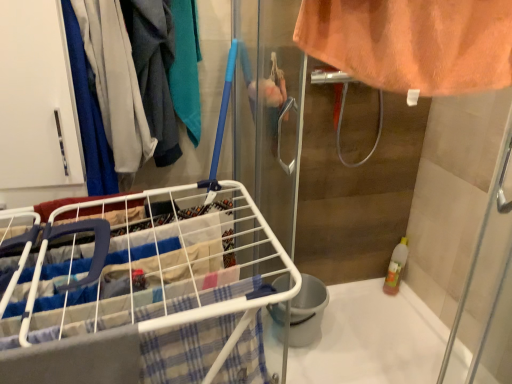
This screenshot has width=512, height=384. What do you see at coordinates (145, 74) in the screenshot? I see `matte blue fabric at left` at bounding box center [145, 74].

Find the location of a particular element. The width and height of the screenshot is (512, 384). white glossy bath at lower right is located at coordinates (372, 339).

From a real-world perspective, is white glossy bath at lower right above or below matte blue fabric at left?

white glossy bath at lower right is situated lower than matte blue fabric at left in the real world.

Could you tell me if white glossy bath at lower right is turned towards matte blue fabric at left?

No.

How much distance is there between white glossy bath at lower right and matte blue fabric at left?

white glossy bath at lower right and matte blue fabric at left are 3.67 feet apart.

Considering the sizes of objects white glossy bath at lower right and matte blue fabric at left in the image provided, who is smaller, white glossy bath at lower right or matte blue fabric at left?

Smaller between the two is matte blue fabric at left.

Is point (3, 329) closer or farther from the camera than point (177, 102)?

Point (3, 329) is closer to the camera than point (177, 102).

Consider the image. Is white wire laundry cart at lower left not inside matte blue fabric at left?

Absolutely, white wire laundry cart at lower left is external to matte blue fabric at left.

Which of these two, white wire laundry cart at lower left or matte blue fabric at left, is smaller?

With smaller size is matte blue fabric at left.

Which object is closer to the camera taking this photo, white wire laundry cart at lower left or white glossy bath at lower right?

Positioned in front is white wire laundry cart at lower left.

Is point (30, 290) positioned after point (408, 293)?

No.

From the image's perspective, is white wire laundry cart at lower left below white glossy bath at lower right?

Incorrect, from the image's perspective, white wire laundry cart at lower left is higher than white glossy bath at lower right.

From a real-world perspective, is white glossy bath at lower right under white wire laundry cart at lower left?

Yes, from a real-world perspective, white glossy bath at lower right is under white wire laundry cart at lower left.

Is white glossy bath at lower right taller than white wire laundry cart at lower left?

No.

Based on the photo, between white glossy bath at lower right and white wire laundry cart at lower left, which one appears on the left side from the viewer's perspective?

Positioned to the left is white wire laundry cart at lower left.

Is matte blue fabric at left located outside white wire laundry cart at lower left?

That's correct, matte blue fabric at left is outside of white wire laundry cart at lower left.

From a real-world perspective, between matte blue fabric at left and white wire laundry cart at lower left, who is vertically higher?

matte blue fabric at left, from a real-world perspective.

Considering the sizes of objects matte blue fabric at left and white wire laundry cart at lower left in the image provided, who is wider, matte blue fabric at left or white wire laundry cart at lower left?

Wider between the two is white wire laundry cart at lower left.

Considering the positions of objects matte blue fabric at left and white wire laundry cart at lower left in the image provided, who is in front, matte blue fabric at left or white wire laundry cart at lower left?

white wire laundry cart at lower left is in front.

From the image's perspective, is matte blue fabric at left over white glossy bath at lower right?

Correct, matte blue fabric at left appears higher than white glossy bath at lower right in the image.

The height and width of the screenshot is (384, 512). Identify the location of clothing located on the left of white glossy bath at lower right. (145, 74).

From a real-world perspective, is matte blue fabric at left located higher than white glossy bath at lower right?

Correct, in the physical world, matte blue fabric at left is higher than white glossy bath at lower right.

Is point (176, 139) behind point (357, 307)?

That is False.

Find the location of a particular element. The image size is (512, 384). bath below the matte blue fabric at left (from the image's perspective) is located at coordinates (372, 339).

Identify the location of clothing that appears behind the white wire laundry cart at lower left. pos(145,74).

Based on their spatial positions, is matte blue fabric at left or white wire laundry cart at lower left closer to white glossy bath at lower right?

white wire laundry cart at lower left lies closer to white glossy bath at lower right than the other object.

Looking at the image, which one is located further to matte blue fabric at left, white glossy bath at lower right or white wire laundry cart at lower left?

The object further to matte blue fabric at left is white glossy bath at lower right.

Based on their spatial positions, is white glossy bath at lower right or matte blue fabric at left further from white wire laundry cart at lower left?

Based on the image, white glossy bath at lower right appears to be further to white wire laundry cart at lower left.

Considering their positions, is white wire laundry cart at lower left positioned further to matte blue fabric at left than white glossy bath at lower right?

white glossy bath at lower right lies further to matte blue fabric at left than the other object.

Looking at the image, which one is located closer to white glossy bath at lower right, white wire laundry cart at lower left or matte blue fabric at left?

Based on the image, white wire laundry cart at lower left appears to be nearer to white glossy bath at lower right.

Considering their positions, is matte blue fabric at left positioned closer to white wire laundry cart at lower left than white glossy bath at lower right?

matte blue fabric at left.

At what (x,y) coordinates should I click in order to perform the action: click on shopping cart between matte blue fabric at left and white glossy bath at lower right in the up-down direction. Please return your answer as a coordinate pair (x, y). Looking at the image, I should click on (145, 302).